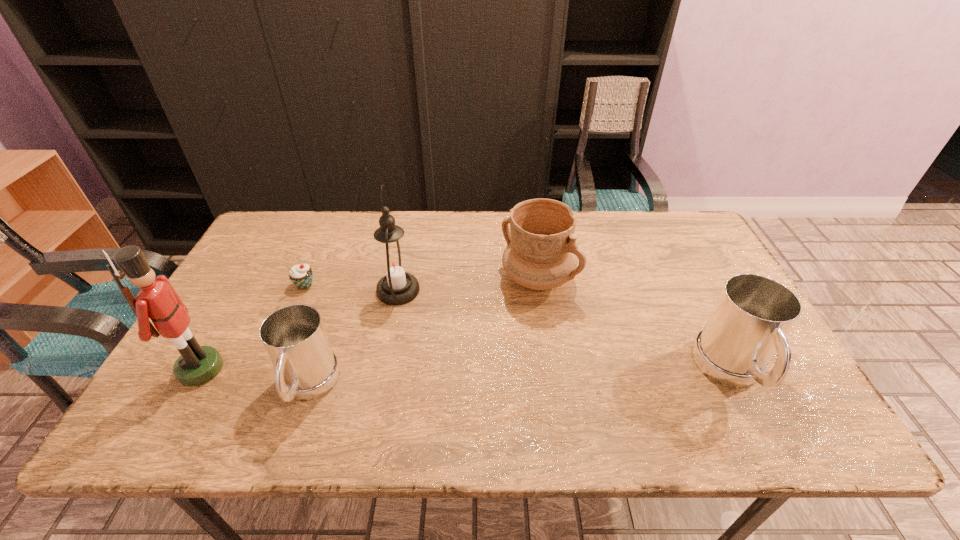
This screenshot has height=540, width=960. I want to click on vacant space located on the left of the pottery, so (395, 279).

Where is `vacant space located 0.300m on the right of the oil lamp`? The height and width of the screenshot is (540, 960). vacant space located 0.300m on the right of the oil lamp is located at coordinates (525, 291).

Image resolution: width=960 pixels, height=540 pixels. I want to click on vacant region located on the front-facing side of the nutcracker, so click(x=260, y=369).

The image size is (960, 540). What are the coordinates of `nutcracker that is at the near edge` in the screenshot? It's located at (157, 299).

Find the location of a particular element. The width and height of the screenshot is (960, 540). object that is at the left edge is located at coordinates (157, 299).

Locate an element on the screen. This screenshot has width=960, height=540. object located in the right edge section of the desktop is located at coordinates [753, 314].

I want to click on object that is at the near left corner, so click(x=157, y=299).

What are the coordinates of `object that is at the near right corner` in the screenshot? It's located at (753, 314).

This screenshot has width=960, height=540. I want to click on vacant area at the far edge, so click(x=422, y=250).

In the image, there is a desktop. Where is `blank space at the near edge`? The height and width of the screenshot is (540, 960). blank space at the near edge is located at coordinates (451, 392).